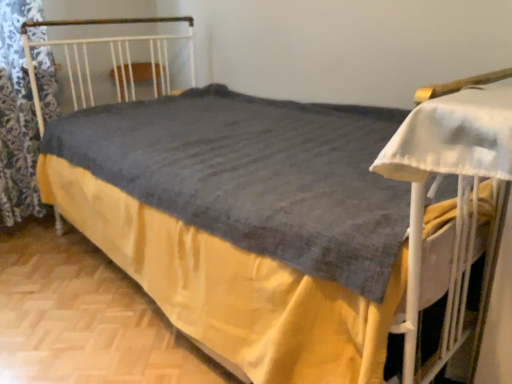
This screenshot has height=384, width=512. Describe the element at coordinates (17, 117) in the screenshot. I see `floral fabric curtain at left` at that location.

Where is `floral fabric curtain at left`? The height and width of the screenshot is (384, 512). floral fabric curtain at left is located at coordinates (17, 117).

Where is `floral fabric curtain at left`? This screenshot has width=512, height=384. floral fabric curtain at left is located at coordinates (17, 117).